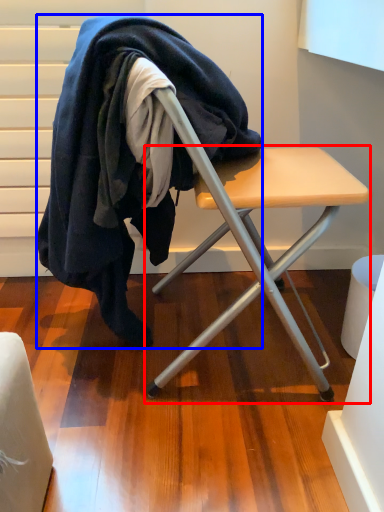
Question: Among these objects, which one is nearest to the camera, table (highlighted by a red box) or wool (highlighted by a blue box)?

Choices:
 (A) table
 (B) wool

Answer: (A)